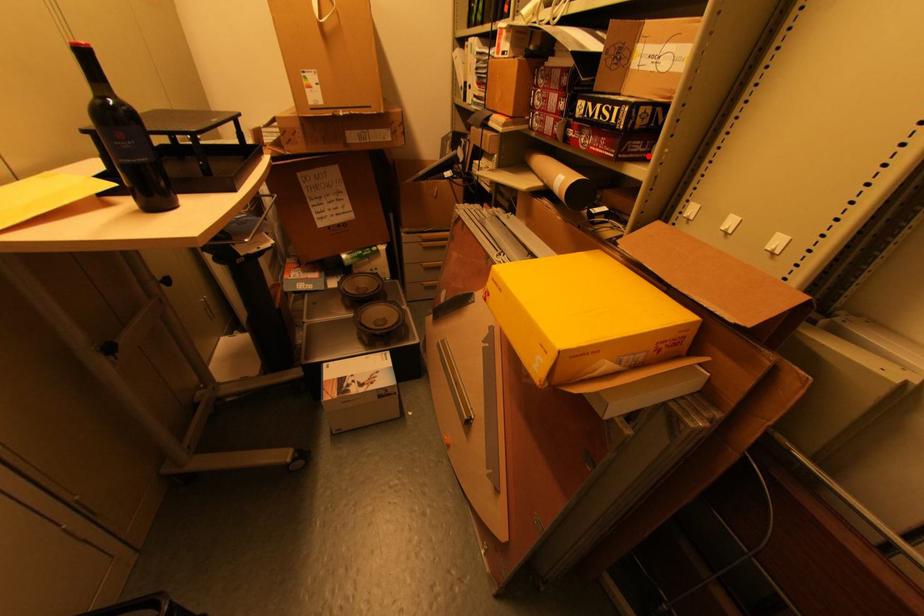
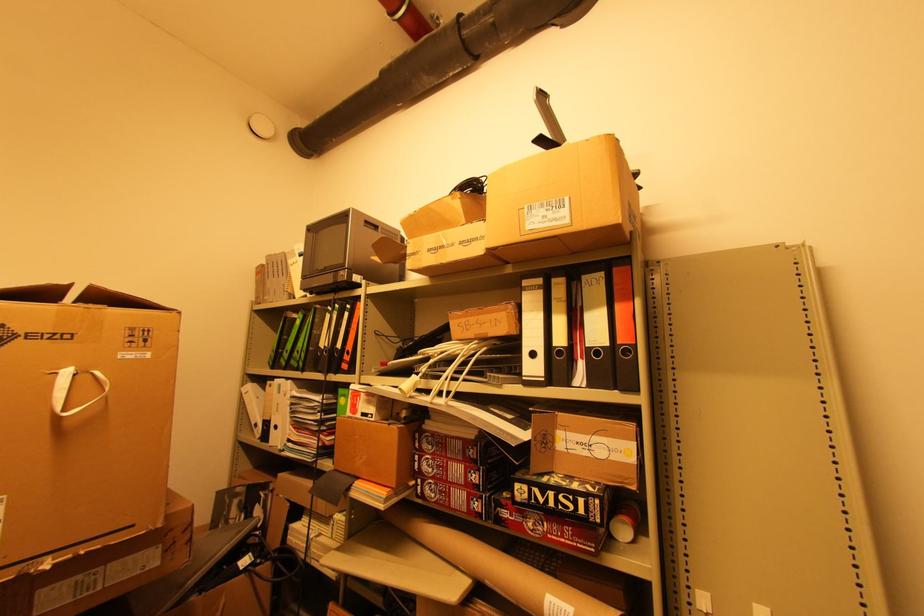
Question: I am providing you with two images of the same scene from different viewpoints. In image1, a red point is highlighted. Considering the same 3D point in image2, which of the following is correct?

Choices:
 (A) It is closer
 (B) It is farther

Answer: (B)